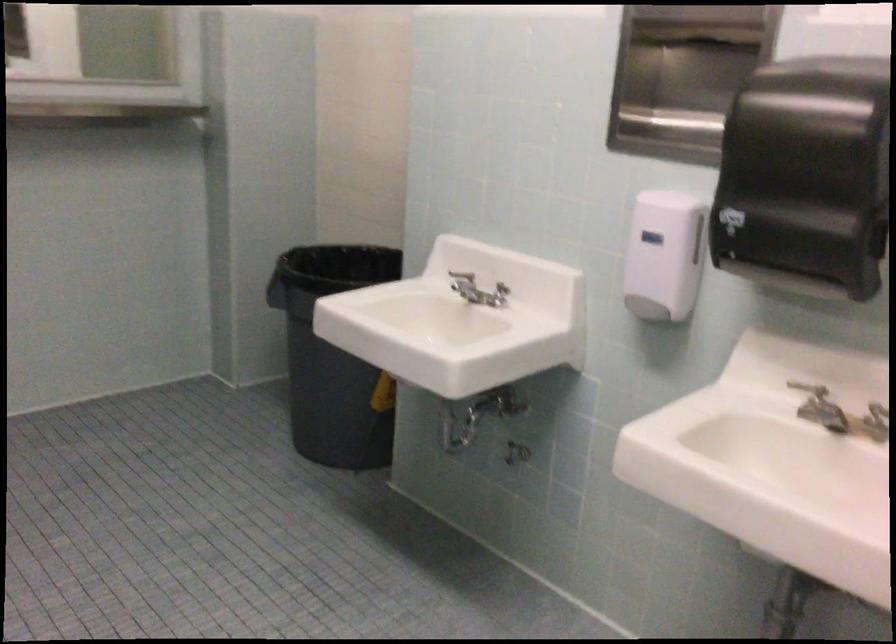
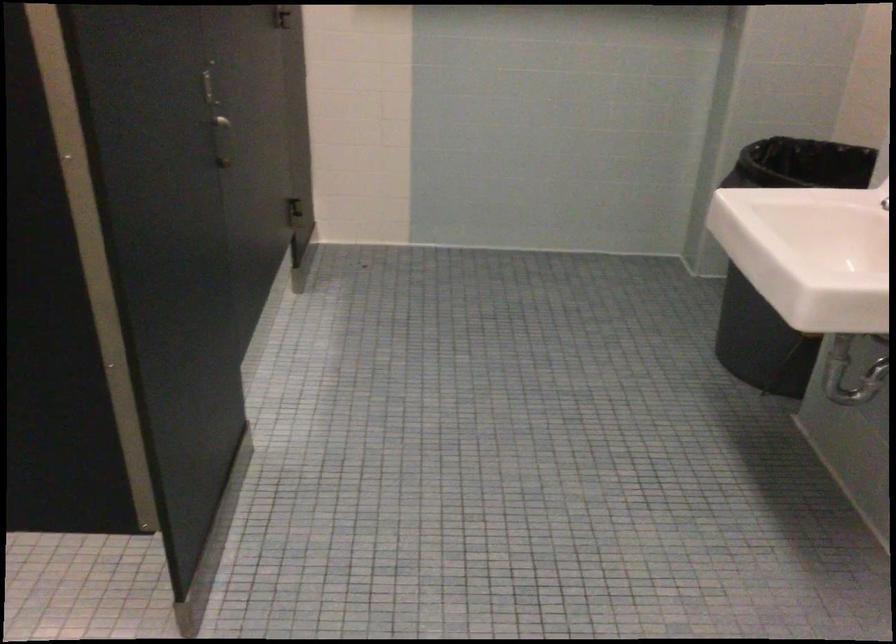
Question: The images are taken continuously from a first-person perspective. In which direction is your viewpoint rotating?

Choices:
 (A) Left
 (B) Right
 (C) Up
 (D) Down

Answer: (A)